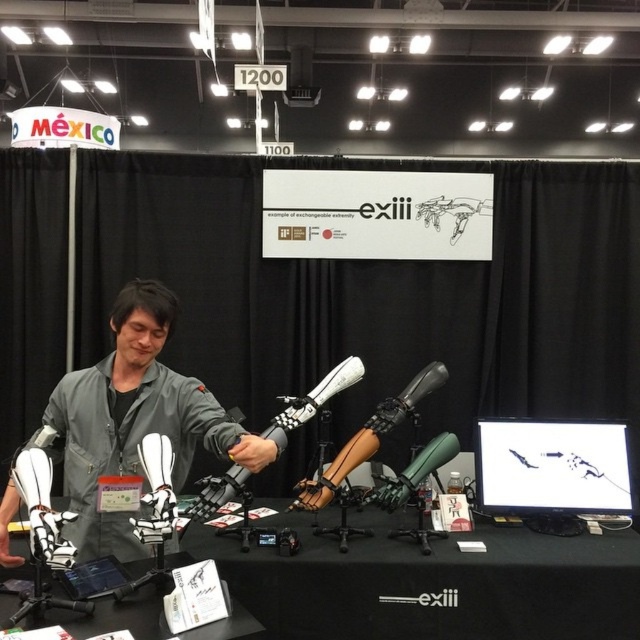
You are at the trade show and need to locate the black matte table at center. According to the coordinates provided, where would you find it?

The black matte table at center is located at point [436,586].

You are an attendee at the trade show and want to ask the representative a question. Which object should you approach first, the black matte table at center or the black matte microphone at center?

The black matte table at center is below the black matte microphone at center, so you should approach the black matte table at center first as it is lower and closer to your standing position.

You are a visitor at the trade show and want to locate the gray matte jacket at center. According to the coordinates provided, where would you find it in the image?

The gray matte jacket at center is located at the coordinates point (129,417).